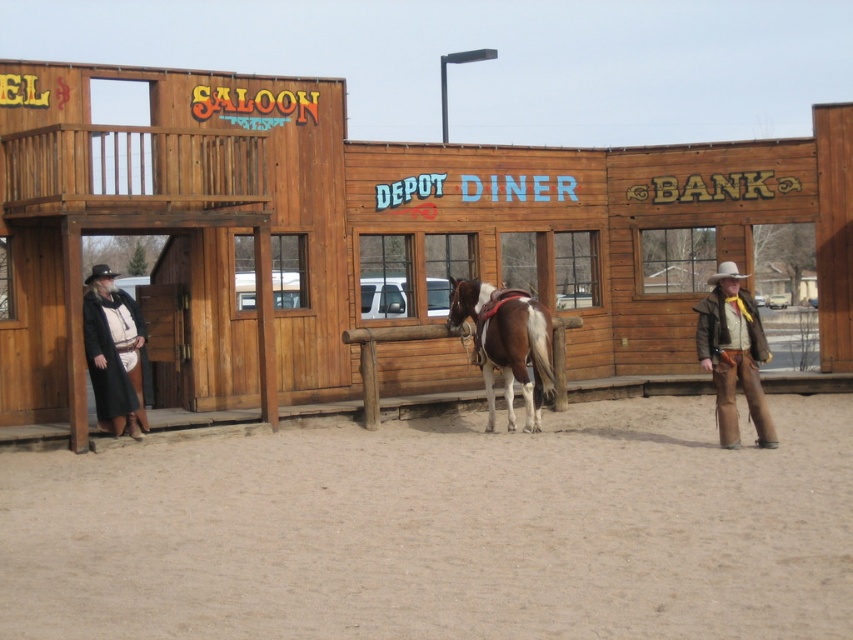
Question: Does brown leather jacket at right appear on the left side of brown leather cowboy hat at center?

Choices:
 (A) no
 (B) yes

Answer: (B)

Question: Which object is closer to the camera taking this photo?

Choices:
 (A) brown leather jacket at right
 (B) brown leather cowboy hat at center

Answer: (A)

Question: Can you confirm if brown glossy horse at center is positioned to the left of brown leather cowboy hat at center?

Choices:
 (A) no
 (B) yes

Answer: (B)

Question: Which of the following is the farthest from the observer?

Choices:
 (A) brown leather jacket at right
 (B) leather jacket at left
 (C) brown glossy horse at center
 (D) brown leather cowboy hat at center

Answer: (B)

Question: Which point appears closest to the camera in this image?

Choices:
 (A) (506, 401)
 (B) (102, 417)
 (C) (726, 312)
 (D) (730, 262)

Answer: (C)

Question: From the image, what is the correct spatial relationship of brown glossy horse at center in relation to brown leather jacket at right?

Choices:
 (A) left
 (B) right

Answer: (A)